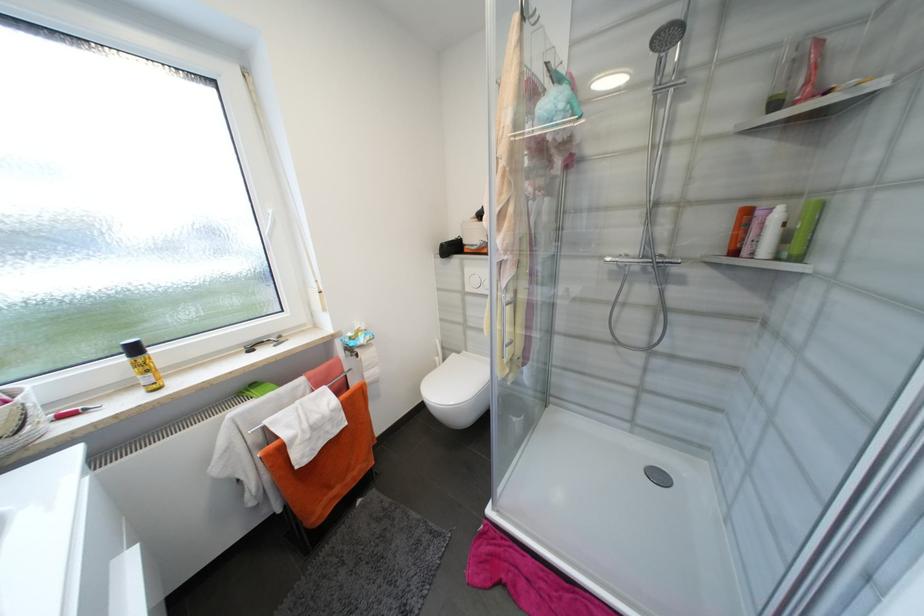
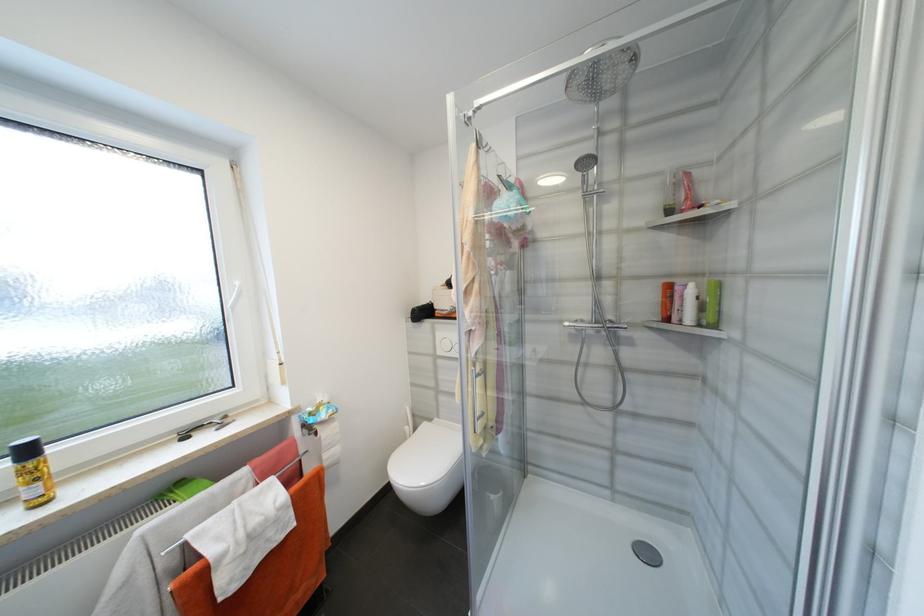
Find the pixel in the second image that matches the point at 784,254 in the first image.

(704, 322)